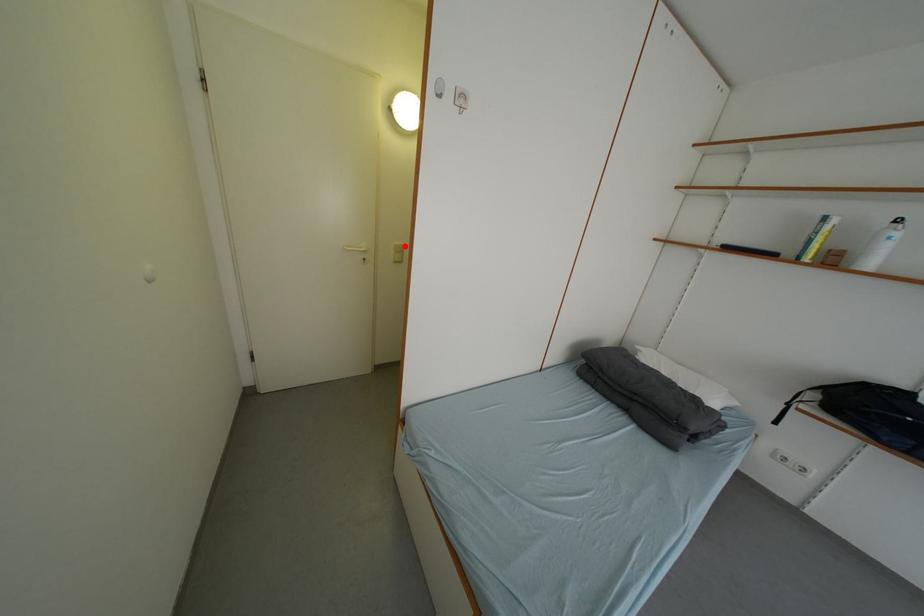
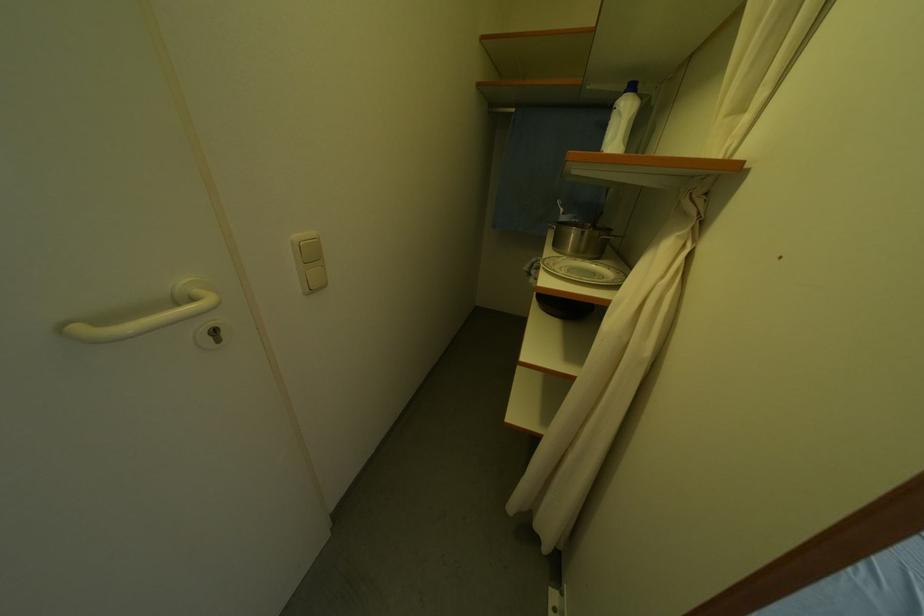
In the second image, find the point that corresponds to the highlighted location in the first image.

(306, 238)